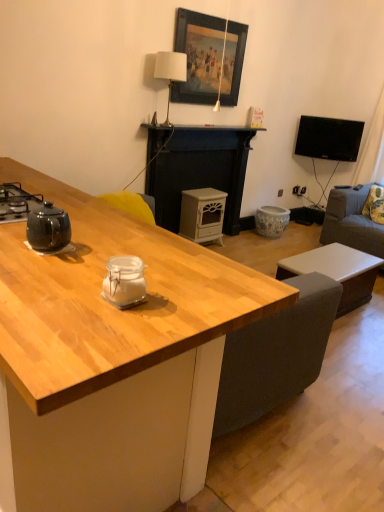
I want to click on wooden framed painting at upper center, so click(x=199, y=56).

At what (x,y) coordinates should I click in order to perform the action: click on shiny black kettle at left. Please return your answer as a coordinate pair (x, y). This screenshot has width=384, height=512. Looking at the image, I should click on (16, 202).

Describe the element at coordinates (124, 281) in the screenshot. This screenshot has height=512, width=384. I see `clear glass jar at center, which appears as the first appliance when ordered from the bottom` at that location.

Measure the distance between point (328,152) and camera.

Point (328,152) is 4.66 meters from camera.

What do you see at coordinates (170, 72) in the screenshot? This screenshot has height=512, width=384. I see `white fabric lampshade at upper center` at bounding box center [170, 72].

Where is `wooden framed painting at upper center`? This screenshot has width=384, height=512. wooden framed painting at upper center is located at coordinates [199, 56].

From the image's perspective, which object appears higher, black glossy tv at upper right or wooden desk at center?

black glossy tv at upper right is shown above in the image.

Considering the relative positions of black glossy tv at upper right and wooden desk at center in the image provided, is black glossy tv at upper right to the left of wooden desk at center from the viewer's perspective?

No, black glossy tv at upper right is not to the left of wooden desk at center.

Which of these two, black glossy tv at upper right or wooden desk at center, is wider?

wooden desk at center.

Which point is more forward, (176,423) or (336,222)?

The point (176,423) is closer.

Is wooden desk at center situated inside gray fabric couch at right or outside?

wooden desk at center is spatially situated outside gray fabric couch at right.

Looking at this image, which object is positioned more to the left, wooden desk at center or gray fabric couch at right?

Positioned to the left is wooden desk at center.

What's the angular difference between wooden desk at center and gray fabric couch at right's facing directions?

The facing directions of wooden desk at center and gray fabric couch at right are 1.89 degrees apart.

Identify the location of appliance behind the white matte fireplace at center. (202, 215).

Can you confirm if white matte fireplace at center is taller than white matte wood stove at center, which is counted as the 2th appliance, starting from the left?

Yes.

Which is closer, (192, 134) or (193, 238)?

The point (192, 134) is more forward.

From a real-world perspective, is white matte wood stove at center, arranged as the first appliance when viewed from the top, on gray fabric couch at right?

No.

Is white matte wood stove at center, which is counted as the 2th appliance, starting from the left, directly adjacent to gray fabric couch at right?

They are not placed beside each other.

Considering the sizes of objects white matte wood stove at center, placed as the 1th appliance when sorted from right to left, and gray fabric couch at right in the image provided, who is taller, white matte wood stove at center, placed as the 1th appliance when sorted from right to left, or gray fabric couch at right?

gray fabric couch at right.

Measure the distance from white matte wood stove at center, arranged as the first appliance when viewed from the top, to gray fabric couch at right.

white matte wood stove at center, arranged as the first appliance when viewed from the top, and gray fabric couch at right are 3.98 feet apart.

Considering the relative positions of wooden framed painting at upper center and clear glass jar at center, marked as the 2th appliance in a top-to-bottom arrangement, in the image provided, is wooden framed painting at upper center to the right of clear glass jar at center, marked as the 2th appliance in a top-to-bottom arrangement, from the viewer's perspective?

Yes.

Is wooden framed painting at upper center facing away from clear glass jar at center, the 2th appliance when ordered from right to left?

No.

Are wooden framed painting at upper center and clear glass jar at center, positioned as the second appliance in back-to-front order, making contact?

No, wooden framed painting at upper center is not beside clear glass jar at center, positioned as the second appliance in back-to-front order.

Between wooden desk at center and black glossy tv at upper right, which one has larger width?

With larger width is wooden desk at center.

From the picture: Is black glossy tv at upper right inside wooden desk at center?

No, black glossy tv at upper right is not surrounded by wooden desk at center.

Can you confirm if wooden desk at center is taller than black glossy tv at upper right?

Correct, wooden desk at center is much taller as black glossy tv at upper right.

Is wooden desk at center oriented away from black glossy tv at upper right?

Yes, black glossy tv at upper right is at the back of wooden desk at center.

From a real-world perspective, is wooden framed painting at upper center physically located above or below wooden desk at center?

wooden framed painting at upper center is above wooden desk at center.

Which of these two, wooden framed painting at upper center or wooden desk at center, is bigger?

wooden desk at center.

Based on the photo, from the image's perspective, which is above, wooden framed painting at upper center or wooden desk at center?

wooden framed painting at upper center, from the image's perspective.

Who is shorter, wooden framed painting at upper center or wooden desk at center?

With less height is wooden framed painting at upper center.

You are a GUI agent. You are given a task and a screenshot of the screen. Output one action in this format:
    pyautogui.click(x=<x>, y=<y>)
    Task: Click on the television behind the wooden desk at center
    The width and height of the screenshot is (384, 512).
    Given the screenshot: What is the action you would take?
    pyautogui.click(x=329, y=138)

Locate an element on the screen. desk on the left of gray fabric couch at right is located at coordinates (112, 360).

Which object lies nearer to the anchor point wooden framed painting at upper center, white matte fireplace at center or gray fabric couch at right?

Among the two, white matte fireplace at center is located nearer to wooden framed painting at upper center.

From the image, which object appears to be nearer to gray fabric couch at right, white matte wood stove at center, arranged as the first appliance when viewed from the top, or white matte fireplace at center?

The object closer to gray fabric couch at right is white matte wood stove at center, arranged as the first appliance when viewed from the top.

Considering their positions, is gray fabric couch at right positioned closer to black glossy tv at upper right than white matte wood stove at center, which is counted as the 2th appliance, starting from the left?

gray fabric couch at right.

Considering their positions, is wooden desk at center positioned closer to black glossy tv at upper right than white matte rectangular table at lower right?

Among the two, white matte rectangular table at lower right is located nearer to black glossy tv at upper right.

Based on their spatial positions, is gray fabric couch at right or white matte rectangular table at lower right further from clear glass jar at center, positioned as the second appliance in back-to-front order?

Based on the image, gray fabric couch at right appears to be further to clear glass jar at center, positioned as the second appliance in back-to-front order.

Looking at the image, which one is located closer to clear glass jar at center, which appears as the first appliance when ordered from the bottom, wooden desk at center or white matte wood stove at center, which appears as the 1th appliance when viewed from the back?

wooden desk at center is closer to clear glass jar at center, which appears as the first appliance when ordered from the bottom.

Which object lies nearer to the anchor point wooden framed painting at upper center, white matte fireplace at center or black glossy tv at upper right?

Based on the image, white matte fireplace at center appears to be nearer to wooden framed painting at upper center.

When comparing their distances from shiny black kettle at left, does clear glass jar at center, the 2th appliance when ordered from right to left, or white matte rectangular table at lower right seem further?

Based on the image, white matte rectangular table at lower right appears to be further to shiny black kettle at left.

You are a GUI agent. You are given a task and a screenshot of the screen. Output one action in this format:
    pyautogui.click(x=<x>, y=<y>)
    Task: Click on the fireplace between white matte rectangular table at lower right and black glossy tv at upper right in the front-back direction
    This screenshot has height=512, width=384.
    Given the screenshot: What is the action you would take?
    200,170

Where is `picture frame located between wooden desk at center and white matte wood stove at center, which appears as the 1th appliance when viewed from the back, in the depth direction`? This screenshot has height=512, width=384. picture frame located between wooden desk at center and white matte wood stove at center, which appears as the 1th appliance when viewed from the back, in the depth direction is located at coordinates (199, 56).

Locate an element on the screen. This screenshot has height=512, width=384. appliance between wooden desk at center and white fabric lampshade at upper center in the front-back direction is located at coordinates (124, 281).

You are a GUI agent. You are given a task and a screenshot of the screen. Output one action in this format:
    pyautogui.click(x=<x>, y=<y>)
    Task: Click on the lamp between shiny black kettle at left and wooden framed painting at upper center along the z-axis
    
    Given the screenshot: What is the action you would take?
    pyautogui.click(x=170, y=72)